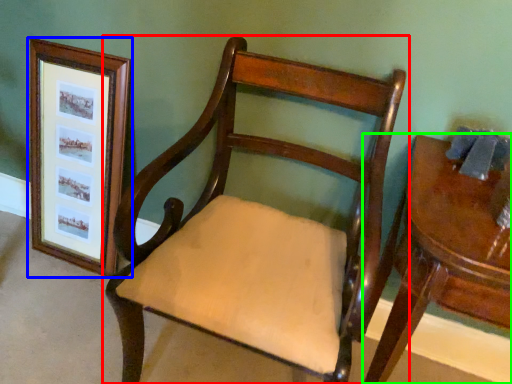
Question: Estimate the real-world distances between objects in this image. Which object is closer to chair (highlighted by a red box), picture frame (highlighted by a blue box) or table (highlighted by a green box)?

Choices:
 (A) picture frame
 (B) table

Answer: (B)